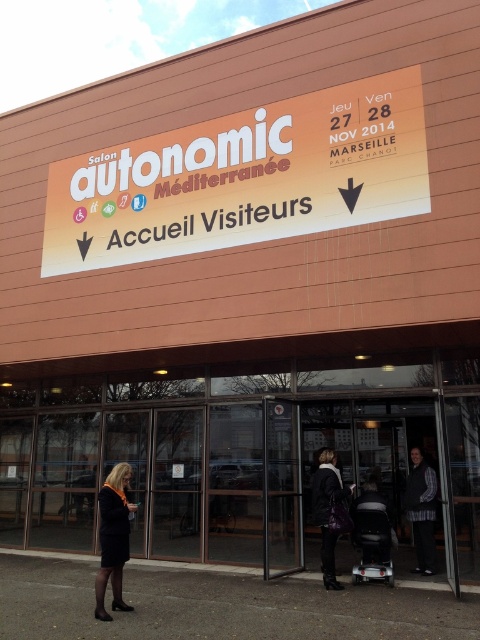
Question: Is black wool coat at lower left above dark brown leather jacket at center?

Choices:
 (A) yes
 (B) no

Answer: (A)

Question: Which point is farther to the camera?

Choices:
 (A) dark brown leather jacket at center
 (B) white plastic baby carriage at lower center
 (C) transparent glass door at center

Answer: (C)

Question: Does black wool coat at lower left come in front of white plastic baby carriage at lower center?

Choices:
 (A) yes
 (B) no

Answer: (A)

Question: Which object is positioned closest to the orange matte sign at upper center?

Choices:
 (A) striped fabric vest at center
 (B) black wool coat at lower left

Answer: (B)

Question: Which object appears farthest from the camera in this image?

Choices:
 (A) white plastic baby carriage at lower center
 (B) black wool coat at lower left
 (C) striped fabric vest at center
 (D) transparent glass door at center

Answer: (D)

Question: Can you confirm if black wool coat at lower left is positioned to the right of white plastic baby carriage at lower center?

Choices:
 (A) no
 (B) yes

Answer: (A)